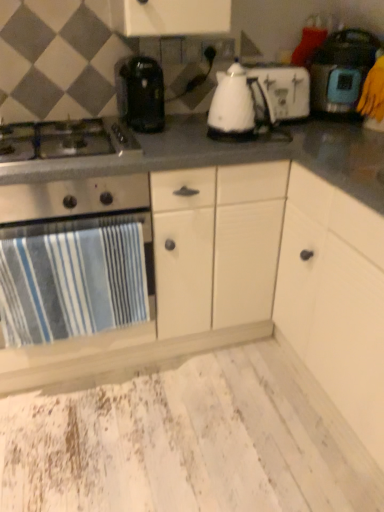
The height and width of the screenshot is (512, 384). I want to click on free space in front of white plastic toaster at center, arranged as the 2th kitchen appliance when viewed from the right, so click(x=293, y=128).